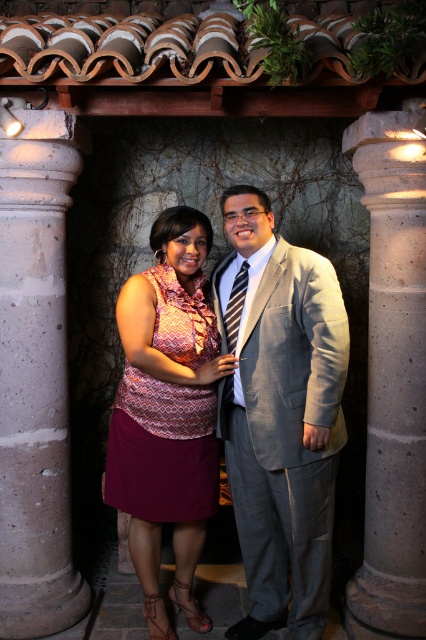
Does matte pink dress at center have a greater height compared to gray concrete column at center?

No.

Which is more to the right, matte pink dress at center or gray concrete column at center?

gray concrete column at center is more to the right.

Find the location of a particular element. matte pink dress at center is located at coordinates (167, 412).

Locate an element on the screen. This screenshot has height=640, width=426. matte pink dress at center is located at coordinates (167, 412).

Is gray concrete column at center thinner than striped fabric tie at center?

No.

Is gray concrete column at center further to camera compared to striped fabric tie at center?

Yes, it is.

Is point (408, 237) positioned after point (235, 312)?

That is True.

The width and height of the screenshot is (426, 640). Identify the location of gray concrete column at center. (393, 372).

What do you see at coordinates (36, 380) in the screenshot? I see `concrete column at left` at bounding box center [36, 380].

The height and width of the screenshot is (640, 426). In order to click on concrete column at left in this screenshot , I will do `click(36, 380)`.

Does point (14, 580) come in front of point (233, 378)?

No, (14, 580) is further to viewer.

Locate an element on the screen. The width and height of the screenshot is (426, 640). concrete column at left is located at coordinates (36, 380).